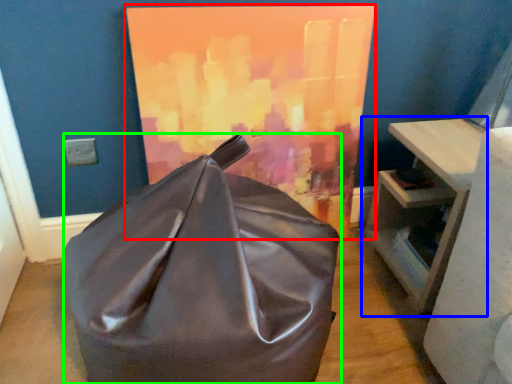
Question: Estimate the real-world distances between objects in this image. Which object is farther from oil painting (highlighted by a red box), table (highlighted by a blue box) or furniture (highlighted by a green box)?

Choices:
 (A) table
 (B) furniture

Answer: (B)